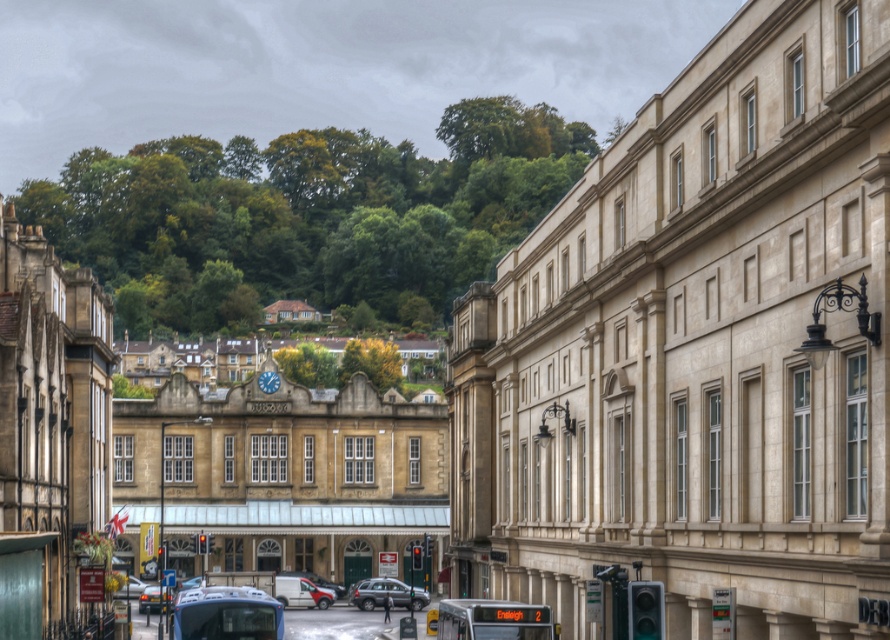
You are standing at the point marked by the coordinate point (301, 593) in the image. Looking around, you see a matte white van at center. Which direction should you face to look towards the green hillside in the background?

You should face towards the background direction because the green hillside is located in the background of the image, while the matte white van at center is in the foreground.